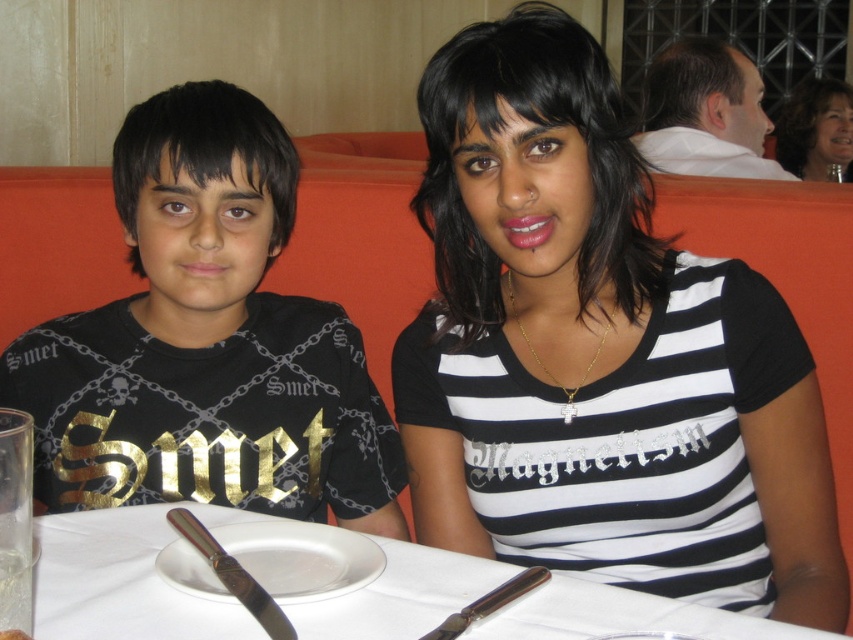
You are a server in a restaurant and need to place a new menu on the table. The menu is the same size as the polished metal knife at lower left. Where should you place the menu so that it fits properly on the white paper table at center?

Since the white paper table at center is larger than the polished metal knife at lower left, the menu can be placed anywhere on the table as it will fit comfortably without issue.

You are a photographer standing at the point marked as point (614, 84). You want to capture a photo of both individuals at the same time. Given that your camera has a maximum focal length that allows capturing subjects up to 40 inches apart, will you be able to include both individuals in the frame?

The two individuals are 39.28 inches apart, which is within the camera maximum focal length of 40 inches. Therefore, you can include both individuals in the frame.